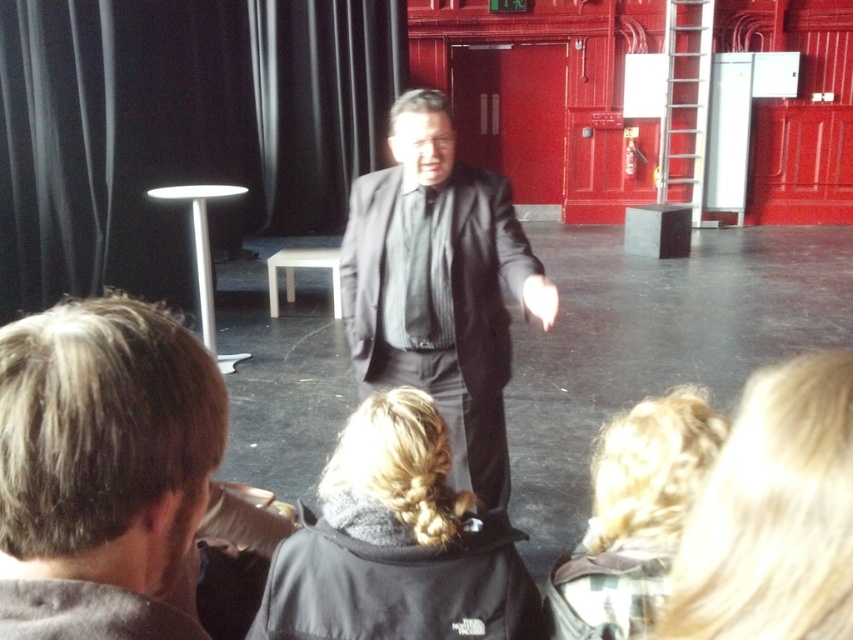
You are a photographer trying to capture a candid shot of the speaker. You notice two individuals with blonde hair at lower right and blonde hair at lower center in the audience. Which person with blonde hair has a shorter hairstyle that might be less likely to obstruct their face in the photo?

The blonde hair at lower right is shorter than the blonde hair at lower center, so the person with blonde hair at lower right has a shorter hairstyle that is less likely to obstruct their face in the photo.

You are standing at the origin point of the coordinate system in the image. The camera is positioned at point A, and the audience is seated at point B. Where is the matte black suit at center located relative to the camera and the audience?

The matte black suit at center is located at point (439, 285) in the coordinate system. Since the camera is at point A and the audience is at point B, the exact position of the matte black suit at center would depend on the specific coordinates of points A and B.

You are a photographer positioned at the back of the room. You need to capture a photo that includes both the matte black suit at center and the blonde hair at lower right. However, your camera has a limited zoom range. Based on their sizes, which object should you focus on first to ensure both are in frame?

The matte black suit at center is bigger than the blonde hair at lower right, so you should focus on the matte black suit at center first to ensure both are in frame.